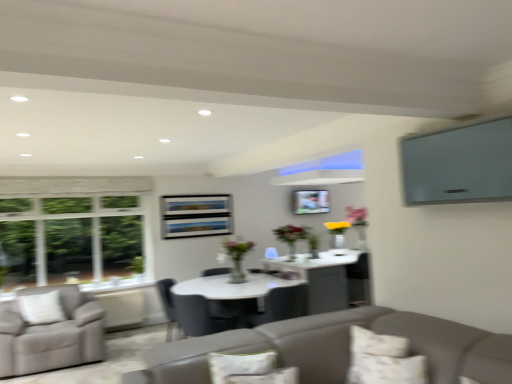
Question: Considering the relative positions of matte black chair at center, which is the first chair in left-to-right order, and matte gray chair at center, which ranks as the 1th chair in right-to-left order, in the image provided, is matte black chair at center, which is the first chair in left-to-right order, to the right of matte gray chair at center, which ranks as the 1th chair in right-to-left order, from the viewer's perspective?

Choices:
 (A) no
 (B) yes

Answer: (A)

Question: From the image's perspective, is matte black chair at center, the second chair when ordered from right to left, over matte gray chair at center, which is counted as the second chair, starting from the left?

Choices:
 (A) yes
 (B) no

Answer: (B)

Question: From a real-world perspective, is matte black chair at center, the second chair when ordered from right to left, on top of matte gray chair at center, which ranks as the 1th chair in right-to-left order?

Choices:
 (A) no
 (B) yes

Answer: (A)

Question: From a real-world perspective, is matte black chair at center, the second chair when ordered from right to left, positioned under matte gray chair at center, which is counted as the second chair, starting from the left, based on gravity?

Choices:
 (A) yes
 (B) no

Answer: (A)

Question: From the image's perspective, would you say matte black chair at center, which is the first chair in left-to-right order, is shown under matte gray chair at center, which is counted as the second chair, starting from the left?

Choices:
 (A) yes
 (B) no

Answer: (A)

Question: Looking at their shapes, would you say matte gray chair at center, which ranks as the 1th chair in right-to-left order, is wider or thinner than fluffy white pillow at lower center, arranged as the 2th pillow when viewed from the right?

Choices:
 (A) thin
 (B) wide

Answer: (B)

Question: Is matte gray chair at center, which ranks as the 1th chair in right-to-left order, situated inside fluffy white pillow at lower center, arranged as the 2th pillow when viewed from the right, or outside?

Choices:
 (A) outside
 (B) inside

Answer: (A)

Question: From a real-world perspective, is matte gray chair at center, which ranks as the 1th chair in right-to-left order, positioned above or below fluffy white pillow at lower center, arranged as the 2th pillow when viewed from the right?

Choices:
 (A) below
 (B) above

Answer: (A)

Question: In the image, is matte gray chair at center, which is counted as the second chair, starting from the left, positioned in front of or behind fluffy white pillow at lower center, arranged as the 2th pillow when viewed from the right?

Choices:
 (A) front
 (B) behind

Answer: (B)

Question: Would you say matte gray chair at center, which is counted as the second chair, starting from the left, is to the left or to the right of matte black chair at center, which is the first chair in left-to-right order, in the picture?

Choices:
 (A) left
 (B) right

Answer: (B)

Question: Is matte gray chair at center, which ranks as the 1th chair in right-to-left order, inside or outside of matte black chair at center, the second chair when ordered from right to left?

Choices:
 (A) outside
 (B) inside

Answer: (A)

Question: From their relative heights in the image, would you say matte gray chair at center, which ranks as the 1th chair in right-to-left order, is taller or shorter than matte black chair at center, the second chair when ordered from right to left?

Choices:
 (A) tall
 (B) short

Answer: (B)

Question: Looking at their shapes, would you say matte gray chair at center, which is counted as the second chair, starting from the left, is wider or thinner than matte black chair at center, the second chair when ordered from right to left?

Choices:
 (A) wide
 (B) thin

Answer: (A)

Question: Do you think fluffy white pillow at lower center, arranged as the 2th pillow when viewed from the right, is within white textured pillow at lower right, which is the 1th pillow from right to left, or outside of it?

Choices:
 (A) inside
 (B) outside

Answer: (B)

Question: From a real-world perspective, is fluffy white pillow at lower center, marked as the first pillow in a left-to-right arrangement, positioned above or below white textured pillow at lower right, the 2th pillow viewed from the left?

Choices:
 (A) below
 (B) above

Answer: (B)